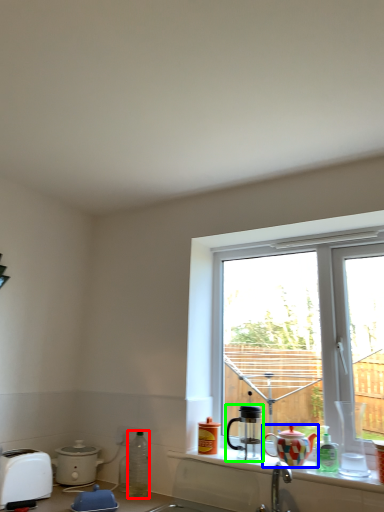
Question: Which object is the closest to the bottle (highlighted by a red box)? Choose among these: teapot (highlighted by a blue box) or coffee cup (highlighted by a green box).

Choices:
 (A) teapot
 (B) coffee cup

Answer: (B)